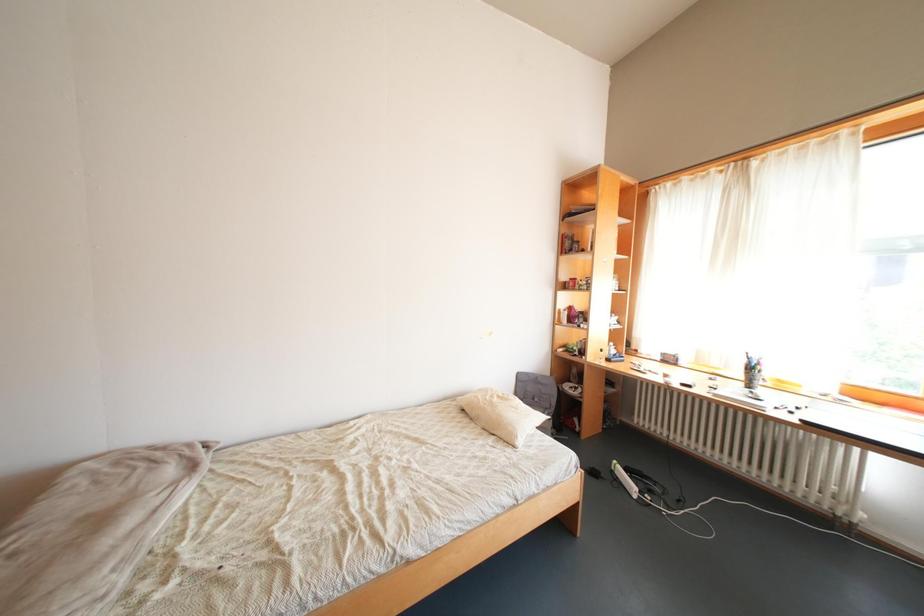
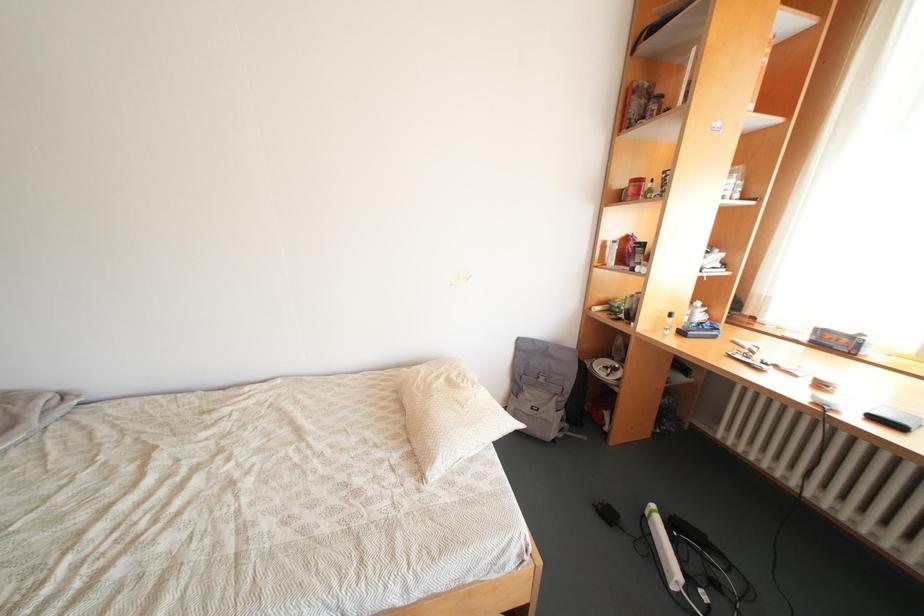
The images are taken continuously from a first-person perspective. In which direction are you moving?

The movement direction of the cameraman is right, forward.